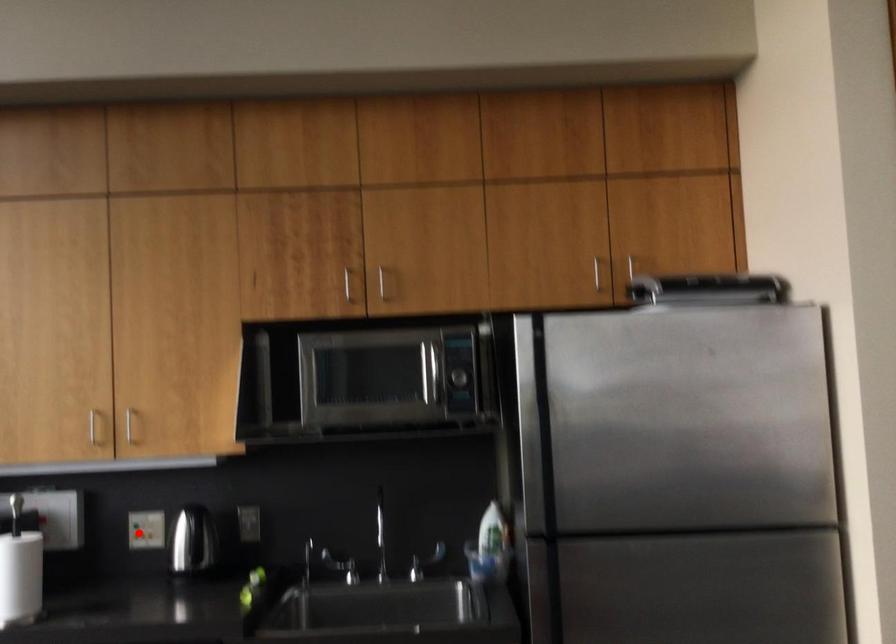
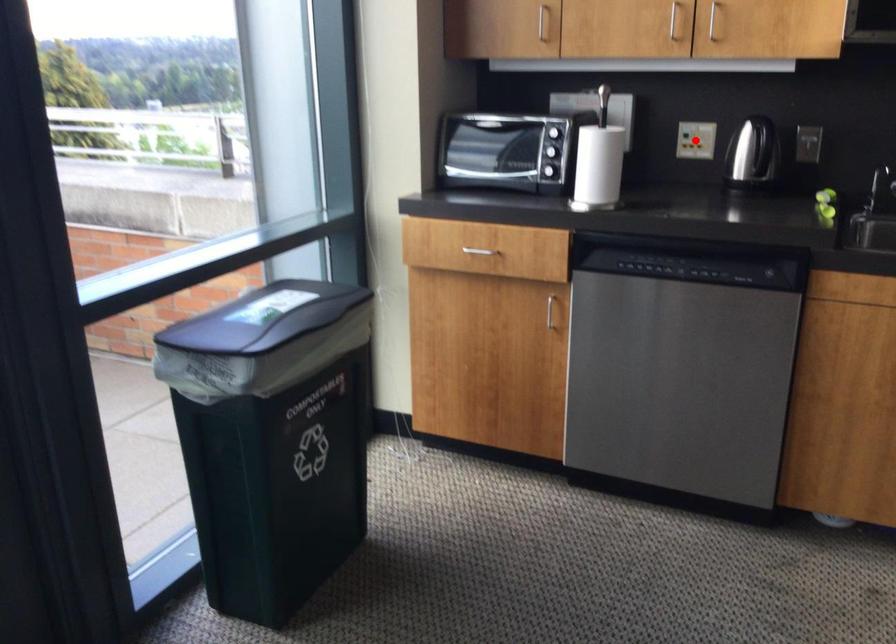
I am providing you with two images of the same scene from different viewpoints. A red point is marked on the first image and another point is marked on the second image. Does the point marked in image1 correspond to the same location as the one in image2?

Yes